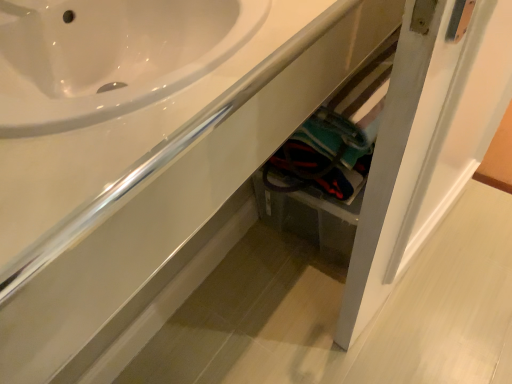
Question: Would you say white glossy sink at upper left is inside or outside white glossy door at lower right?

Choices:
 (A) outside
 (B) inside

Answer: (A)

Question: From the image's perspective, is white glossy sink at upper left located above or below white glossy door at lower right?

Choices:
 (A) above
 (B) below

Answer: (A)

Question: Looking at the image, does white glossy sink at upper left seem bigger or smaller compared to white glossy door at lower right?

Choices:
 (A) small
 (B) big

Answer: (A)

Question: Is white glossy door at lower right bigger or smaller than white glossy sink at upper left?

Choices:
 (A) small
 (B) big

Answer: (B)

Question: Do you think white glossy door at lower right is within white glossy sink at upper left, or outside of it?

Choices:
 (A) outside
 (B) inside

Answer: (A)

Question: From a real-world perspective, is white glossy door at lower right physically located above or below white glossy sink at upper left?

Choices:
 (A) below
 (B) above

Answer: (A)

Question: Looking at their shapes, would you say white glossy door at lower right is wider or thinner than white glossy sink at upper left?

Choices:
 (A) wide
 (B) thin

Answer: (B)